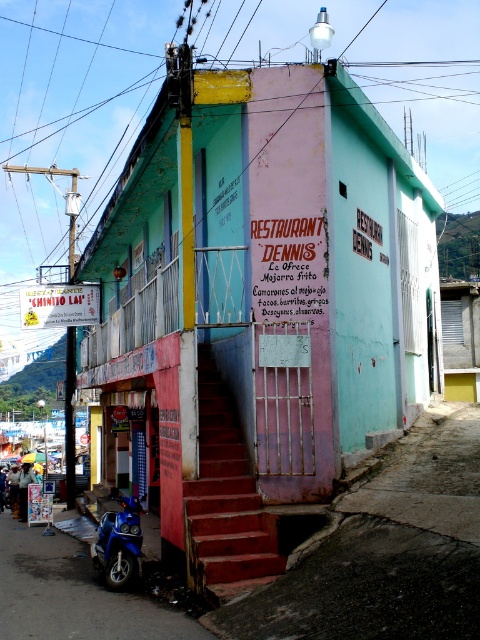
Looking at this image, does blue metallic motorcycle at lower left have a smaller size compared to red painted stairs at center?

Incorrect, blue metallic motorcycle at lower left is not smaller in size than red painted stairs at center.

Who is more forward, [34,560] or [214,563]?

Positioned in front is point [214,563].

Is point (46, 618) in front of point (212, 368)?

Yes, it is.

Locate an element on the screen. blue metallic motorcycle at lower left is located at coordinates (72, 595).

Looking at this image, is red painted stairs at center wider than blue glossy motorcycle at lower left?

Correct, the width of red painted stairs at center exceeds that of blue glossy motorcycle at lower left.

Is red painted stairs at center closer to the viewer compared to blue glossy motorcycle at lower left?

Yes, it is in front of blue glossy motorcycle at lower left.

Which is behind, point (199, 417) or point (101, 548)?

Point (199, 417)

What are the coordinates of `red painted stairs at center` in the screenshot? It's located at (225, 499).

Can you confirm if blue metallic motorcycle at lower left is positioned to the right of blue glossy motorcycle at lower left?

No, blue metallic motorcycle at lower left is not to the right of blue glossy motorcycle at lower left.

Describe the element at coordinates (72, 595) in the screenshot. I see `blue metallic motorcycle at lower left` at that location.

Is point (57, 636) farther from camera compared to point (116, 588)?

No.

This screenshot has height=640, width=480. I want to click on blue metallic motorcycle at lower left, so click(x=72, y=595).